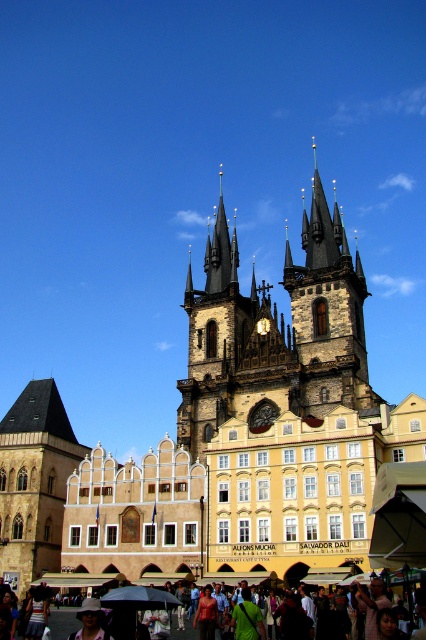
Who is lower down, brown stone church at center or white cotton hat at lower left?

Positioned lower is white cotton hat at lower left.

Does brown stone church at center have a greater width compared to white cotton hat at lower left?

Indeed, brown stone church at center has a greater width compared to white cotton hat at lower left.

This screenshot has width=426, height=640. Identify the location of brown stone church at center. (221, 440).

Which is behind, point (314, 308) or point (66, 611)?

The point (314, 308) is behind.

Can you confirm if dark brown stone tower at center is wider than matte black umbrella at lower center?

Correct, the width of dark brown stone tower at center exceeds that of matte black umbrella at lower center.

Identify the location of dark brown stone tower at center. (325, 314).

Is point (210, 301) less distant than point (302, 285)?

That is False.

You are a GUI agent. You are given a task and a screenshot of the screen. Output one action in this format:
    pyautogui.click(x=<x>, y=<y>)
    Task: Click on the brown stone church at center
    
    Given the screenshot: What is the action you would take?
    pyautogui.click(x=221, y=440)

Where is `brown stone church at center`? This screenshot has height=640, width=426. brown stone church at center is located at coordinates (221, 440).